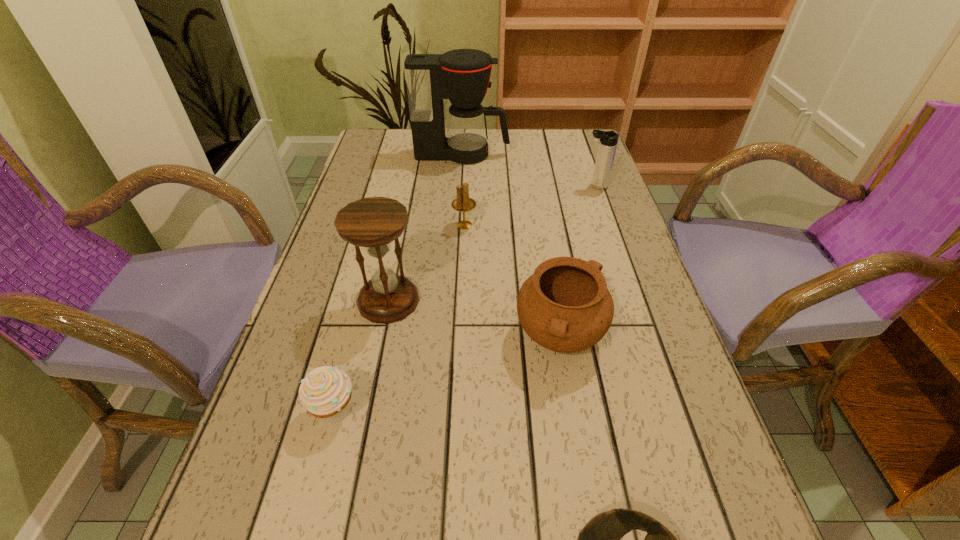
Locate an element on the screen. The height and width of the screenshot is (540, 960). free space located 0.070m on the back of the hourglass is located at coordinates (397, 258).

The width and height of the screenshot is (960, 540). What are the coordinates of `free spot located 0.340m on the handle side of the rightmost object` in the screenshot? It's located at (462, 186).

You are a GUI agent. You are given a task and a screenshot of the screen. Output one action in this format:
    pyautogui.click(x=<x>, y=<y>)
    Task: Click on the vacant space situated 0.140m on the handle side of the rightmost object
    
    Given the screenshot: What is the action you would take?
    pyautogui.click(x=533, y=186)

Find the location of a particular element. Image resolution: width=960 pixels, height=540 pixels. free spot located 0.180m on the handle side of the rightmost object is located at coordinates (519, 186).

Identify the location of vacant space located 0.210m on the front of the pottery. This screenshot has height=540, width=960. (587, 503).

Find the location of a particular element. This screenshot has width=960, height=540. vacant space located 0.220m on the left of the candle holder is located at coordinates (365, 225).

Where is `blank area located 0.150m on the back of the second nearest object`? The width and height of the screenshot is (960, 540). blank area located 0.150m on the back of the second nearest object is located at coordinates click(x=358, y=325).

You are a GUI agent. You are given a task and a screenshot of the screen. Output one action in this format:
    pyautogui.click(x=<x>, y=<y>)
    Task: Click on the object positioned at the far edge
    
    Given the screenshot: What is the action you would take?
    pyautogui.click(x=462, y=75)

The height and width of the screenshot is (540, 960). Identify the location of hourglass that is at the left edge. (373, 223).

Where is `muffin that is at the left edge`? The height and width of the screenshot is (540, 960). muffin that is at the left edge is located at coordinates (325, 392).